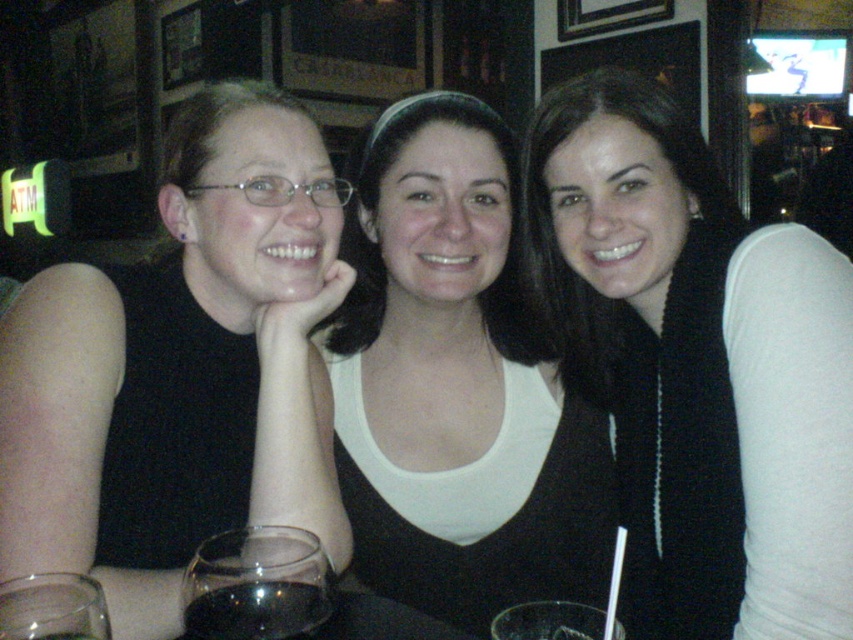
Question: Which object is farther from the camera taking this photo?

Choices:
 (A) black knitted scarf at center
 (B) transparent glass at lower left
 (C) transparent glass at lower center
 (D) matte black shirt at left

Answer: (A)

Question: Does white matte tank top at center appear on the right side of transparent glass at lower left?

Choices:
 (A) no
 (B) yes

Answer: (B)

Question: Which of the following is the farthest from the observer?

Choices:
 (A) (299, 529)
 (B) (612, 285)
 (C) (369, 246)

Answer: (C)

Question: Is the position of black knitted scarf at center more distant than that of white matte tank top at center?

Choices:
 (A) yes
 (B) no

Answer: (B)

Question: Is white matte tank top at center further to the viewer compared to transparent glass at lower center?

Choices:
 (A) no
 (B) yes

Answer: (B)

Question: Among these objects, which one is farthest from the camera?

Choices:
 (A) matte black shirt at left
 (B) transparent glass at lower center

Answer: (A)